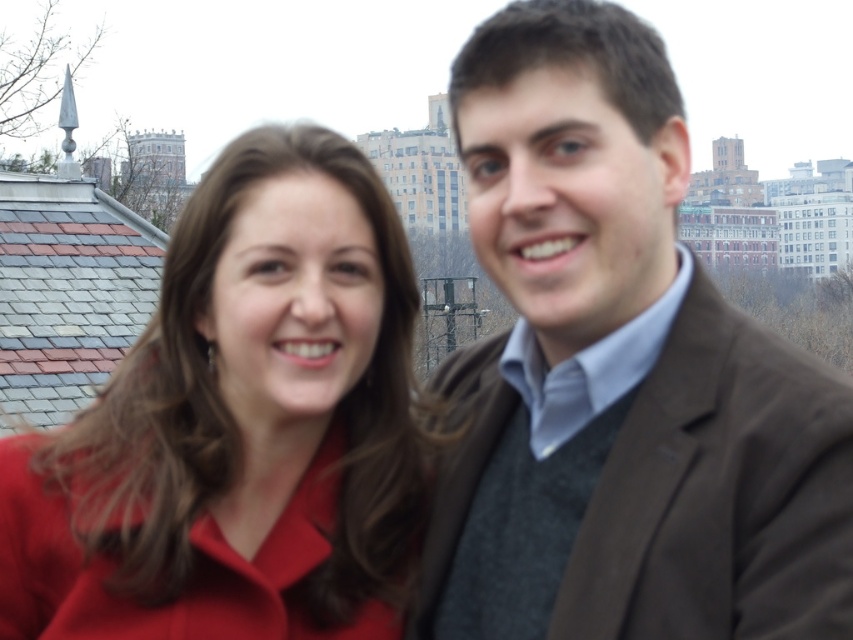
Does matte brown jacket at center have a lesser width compared to matte red coat at center?

Indeed, matte brown jacket at center has a lesser width compared to matte red coat at center.

Which is behind, point (666, 330) or point (364, 220)?

The point (364, 220) is more distant.

In the scene shown: Measure the distance between matte brown jacket at center and camera.

matte brown jacket at center and camera are 89.25 feet apart from each other.

Find the location of a particular element. matte brown jacket at center is located at coordinates (625, 381).